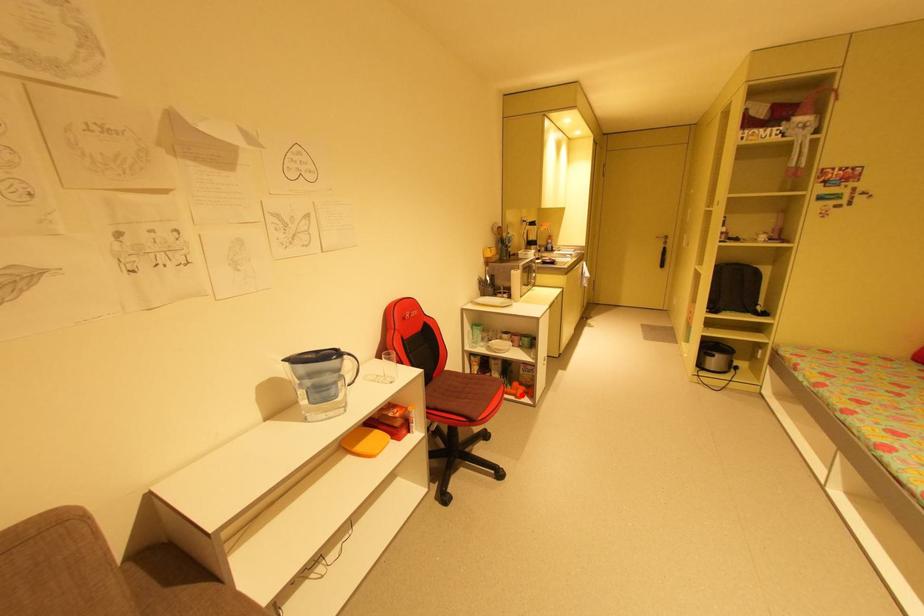
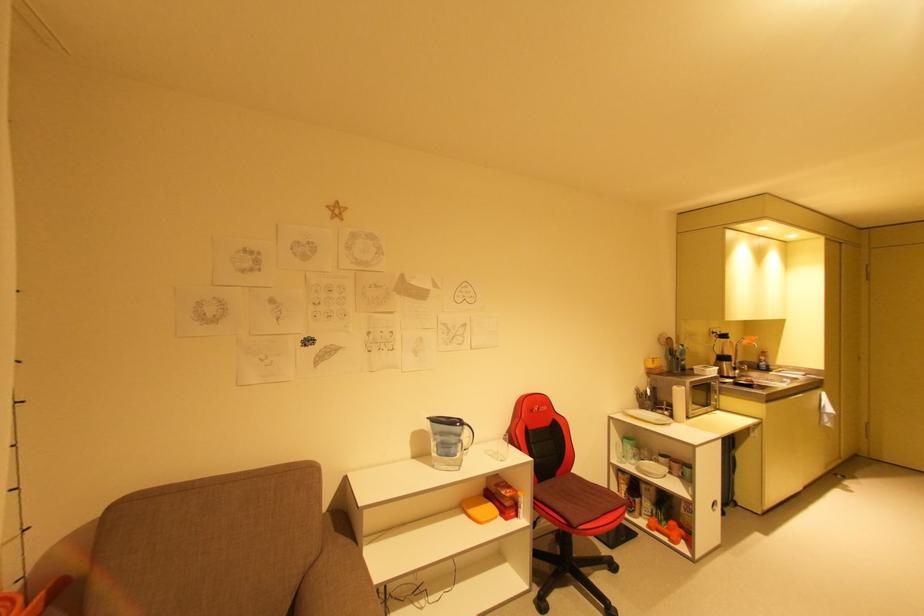
Question: I am providing you with two images of the same scene from different viewpoints. A red point is marked on the first image. Can you still see the location of the red point in image 2?

Choices:
 (A) Yes
 (B) No

Answer: (A)